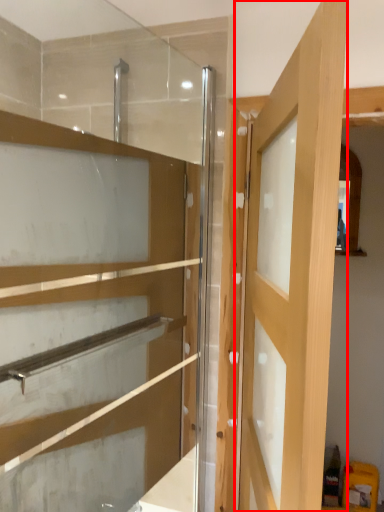
Question: From the image's perspective, what is the correct spatial positioning of door (annotated by the red box) in reference to cabinetry?

Choices:
 (A) below
 (B) above

Answer: (A)